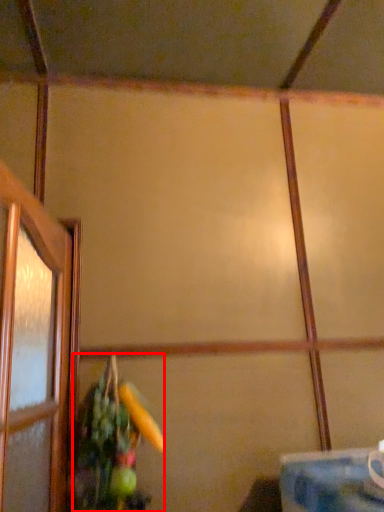
Question: Where is floral arrangement (annotated by the red box) located in relation to table in the image?

Choices:
 (A) right
 (B) left

Answer: (B)